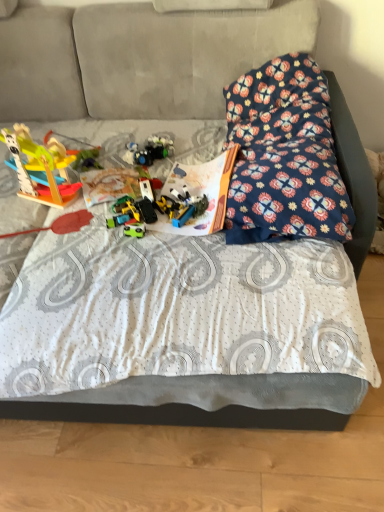
Where is `free spot above plastic toy car at center, the sixth toy when ordered from left to right (from a real-world perspective)`? free spot above plastic toy car at center, the sixth toy when ordered from left to right (from a real-world perspective) is located at coordinates (193, 201).